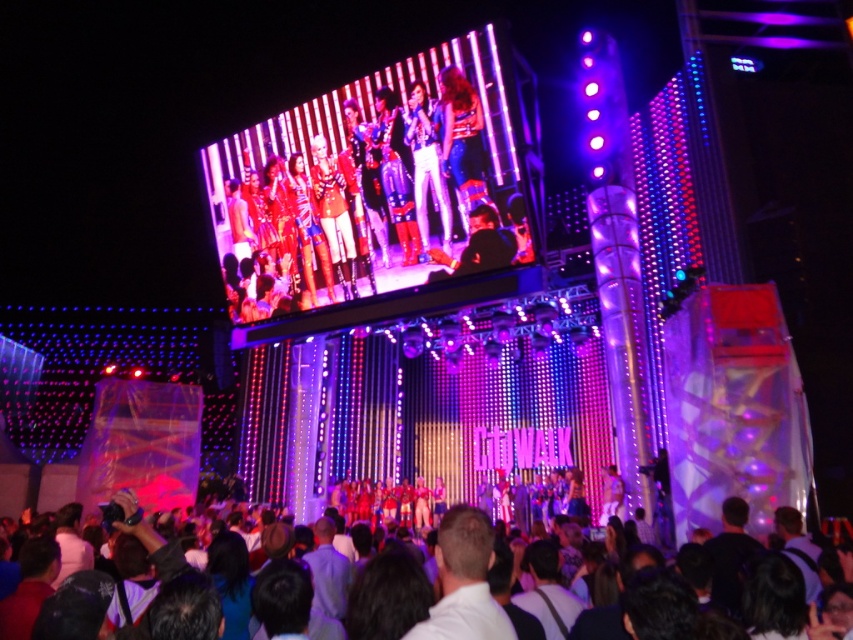
Based on the photo, is shiny metallic jacket at center closer to camera compared to dark brown hair at lower center?

No, shiny metallic jacket at center is behind dark brown hair at lower center.

Find the location of a particular element. This screenshot has height=640, width=853. shiny metallic jacket at center is located at coordinates (x=374, y=186).

The image size is (853, 640). What are the coordinates of `shiny metallic jacket at center` in the screenshot? It's located at (374, 186).